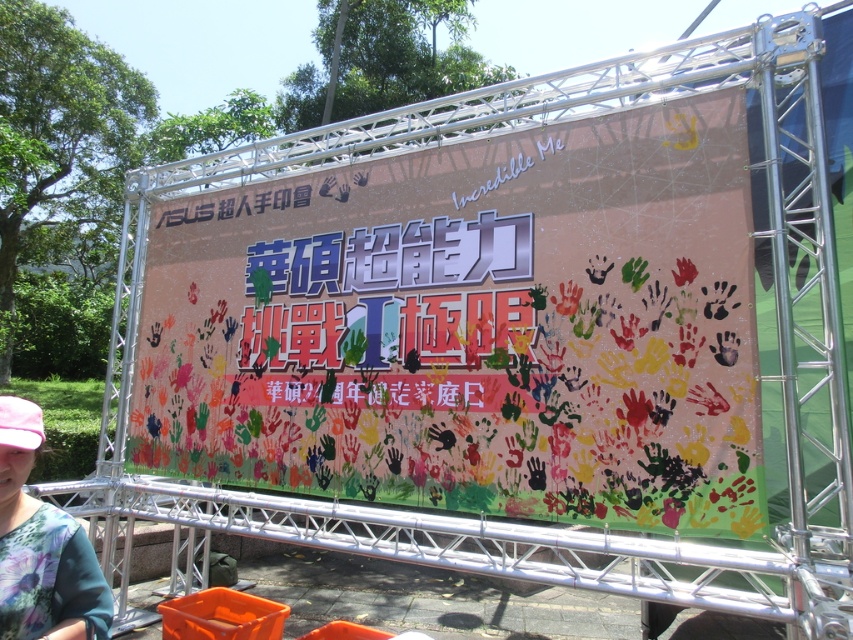
You are setting up for an event and need to place a 4.5 feet wide table between the floral fabric shirt at lower left and the orange plastic crate at lower center. Will there be enough space?

The floral fabric shirt at lower left and orange plastic crate at lower center are 5.31 feet apart. Since the table is 4.5 feet wide, there is enough space to place it between them as the distance between the two objects is greater than the table width.

You are standing at the event and want to take a photo of the banner. There are two points on the banner that you need to focus on. One is at point (520, 310) and the other is at point (277, 618). Which point should you focus on first to ensure both points are in focus?

You should focus on point (520, 310) first because it is closer to you than point (277, 618). By focusing on the closer point, the farther point will also be within the depth of field.

You are at the event and see the floral fabric shirt at lower left and the orange plastic crate at lower center. Which object is covering the other one?

The floral fabric shirt at lower left is positioned over orange plastic crate at lower center, so it is covering the crate.